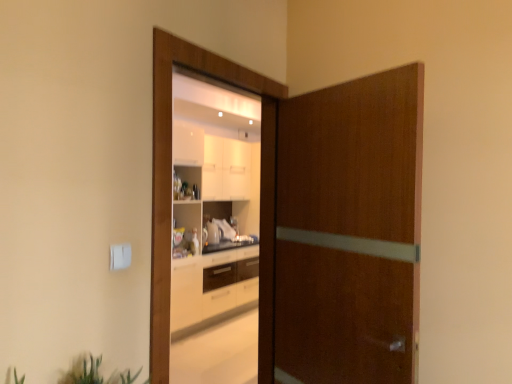
Locate an element on the screen. Image resolution: width=512 pixels, height=384 pixels. empty space that is ontop of wooden door at center, which is the 2th screen door in right-to-left order (from a real-world perspective) is located at coordinates coord(231,60).